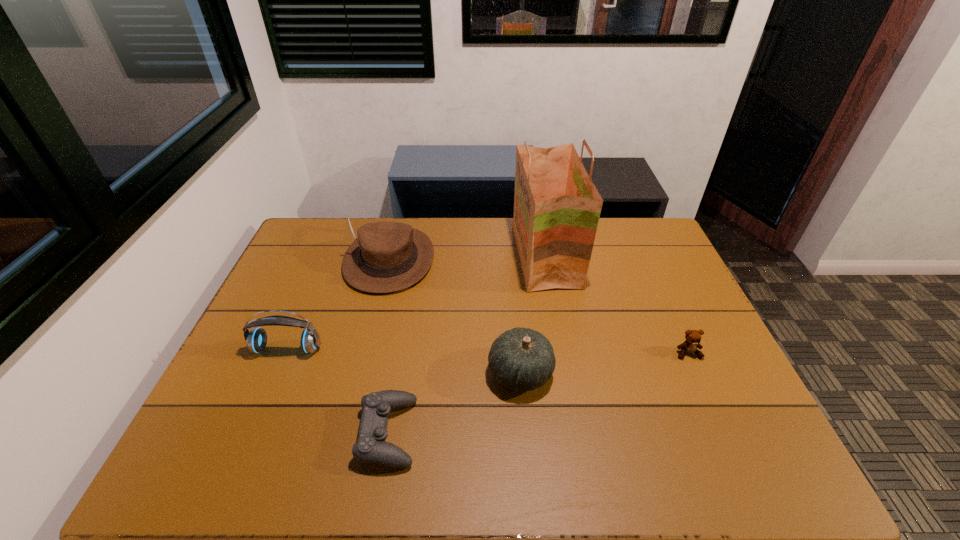
What are the coordinates of `free space between the gourd and the fedora` in the screenshot? It's located at (455, 316).

Locate an element on the screen. This screenshot has width=960, height=540. blank region between the shortest object and the fedora is located at coordinates (389, 346).

Locate which object is the fourth closest to the headset. Please provide its 2D coordinates. Your answer should be formatted as a tuple, i.e. [(x, y)], where the tuple contains the x and y coordinates of a point satisfying the conditions above.

[(557, 207)]

Locate which object ranks third in proximity to the headset. Please provide its 2D coordinates. Your answer should be formatted as a tuple, i.e. [(x, y)], where the tuple contains the x and y coordinates of a point satisfying the conditions above.

[(522, 359)]

Find the location of a particular element. free space that satisfies the following two spatial constraints: 1. on the ear cups of the control; 2. on the left side of the headset is located at coordinates (252, 433).

The height and width of the screenshot is (540, 960). In order to click on vacant space that satisfies the following two spatial constraints: 1. on the feather side of the shortest object; 2. on the left side of the fedora in this screenshot , I will do [347, 433].

Image resolution: width=960 pixels, height=540 pixels. Identify the location of free space that satisfies the following two spatial constraints: 1. on the ear cups of the control; 2. on the left side of the headset. point(252,433).